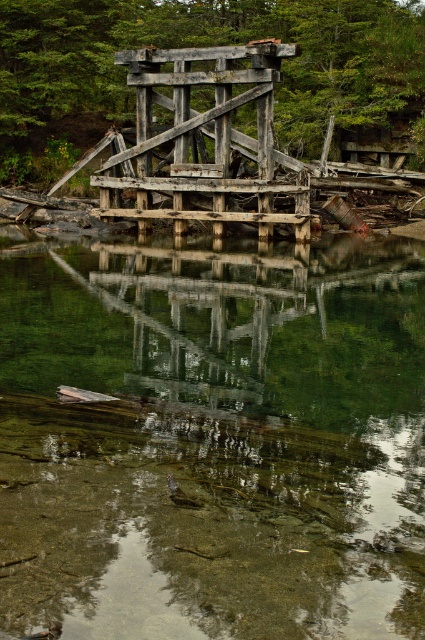
You are a kayaker approaching the scene. You see the clear glass water at center and the rusty wooden bridge at center. Which object is located below the other?

The clear glass water at center is positioned under the rusty wooden bridge at center, so the water is below the bridge.